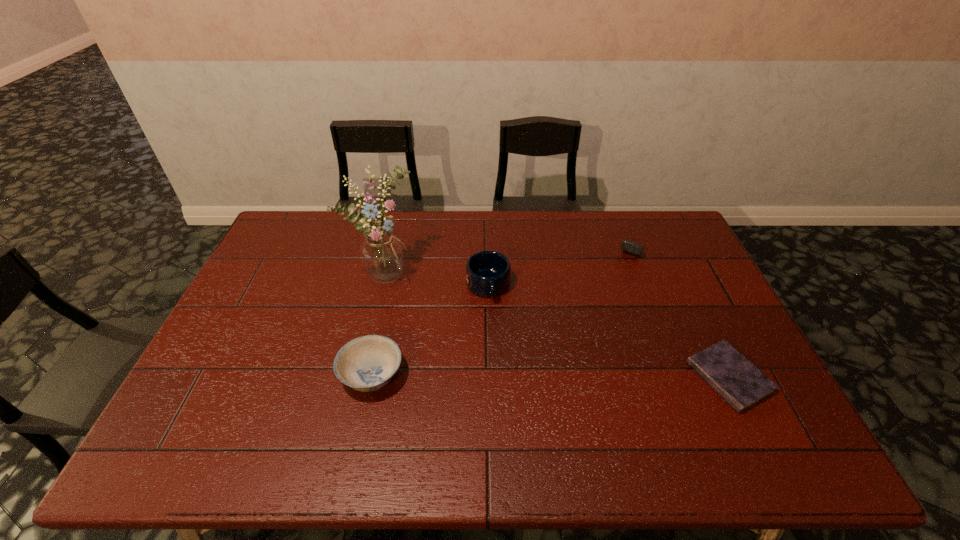
Locate an element on the screen. free point between the bowl and the bouquet is located at coordinates (378, 324).

Locate which object is the closest to the third shortest object. Please provide its 2D coordinates. Your answer should be formatted as a tuple, i.e. [(x, y)], where the tuple contains the x and y coordinates of a point satisfying the conditions above.

[(382, 254)]

Point out which object is positioned as the third nearest to the mug. Please provide its 2D coordinates. Your answer should be formatted as a tuple, i.e. [(x, y)], where the tuple contains the x and y coordinates of a point satisfying the conditions above.

[(634, 248)]

Locate an element on the screen. free point that satisfies the following two spatial constraints: 1. on the front side of the bouquet; 2. on the left side of the bowl is located at coordinates (361, 375).

Where is `free space that satisfies the following two spatial constraints: 1. on the front side of the bowl; 2. on the right side of the bouquet`? The height and width of the screenshot is (540, 960). free space that satisfies the following two spatial constraints: 1. on the front side of the bowl; 2. on the right side of the bouquet is located at coordinates (361, 375).